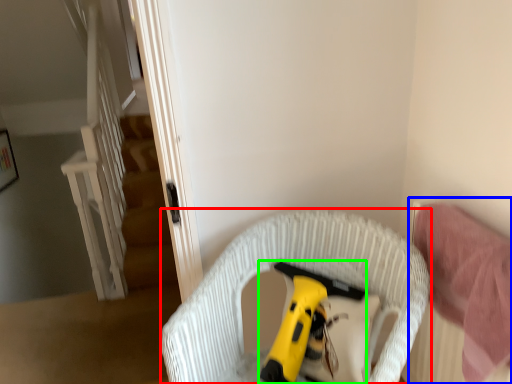
Question: Based on their relative distances, which object is farther from furniture (highlighted by a red box)? Choose from bed (highlighted by a blue box) and toy (highlighted by a green box).

Choices:
 (A) bed
 (B) toy

Answer: (A)